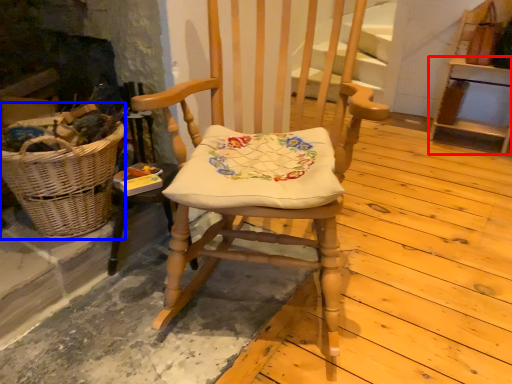
Question: Which of the following is the closest to the observer, furniture (highlighted by a red box) or picnic basket (highlighted by a blue box)?

Choices:
 (A) furniture
 (B) picnic basket

Answer: (B)